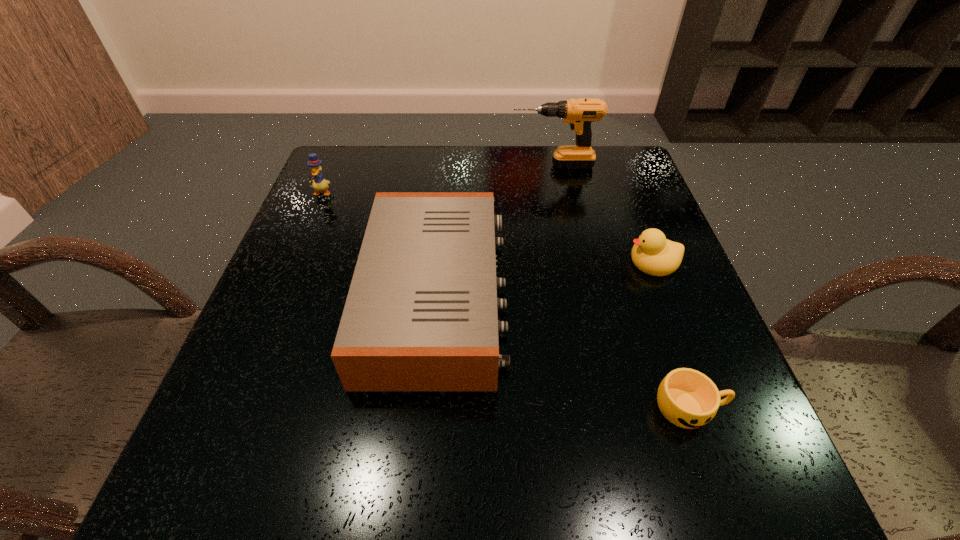
Identify the location of drill at the right edge. The height and width of the screenshot is (540, 960). (579, 113).

The image size is (960, 540). What are the coordinates of `duckling located in the right edge section of the desktop` in the screenshot? It's located at (653, 254).

Where is `cup that is at the right edge`? This screenshot has height=540, width=960. cup that is at the right edge is located at coordinates (687, 398).

In order to click on object that is at the far left corner in this screenshot , I will do `click(319, 183)`.

Locate an element on the screen. The height and width of the screenshot is (540, 960). object at the far right corner is located at coordinates [x=579, y=113].

Where is `blank area at the far edge`? The width and height of the screenshot is (960, 540). blank area at the far edge is located at coordinates (498, 177).

Where is `free space at the near edge of the desktop`? free space at the near edge of the desktop is located at coordinates (x=612, y=471).

The image size is (960, 540). Find the location of `free space at the left edge of the desktop`. free space at the left edge of the desktop is located at coordinates (363, 236).

In the image, there is a desktop. Find the location of `vacant space at the right edge`. vacant space at the right edge is located at coordinates (691, 349).

The height and width of the screenshot is (540, 960). In the image, there is a desktop. In order to click on free space at the far left corner in this screenshot , I will do `click(366, 187)`.